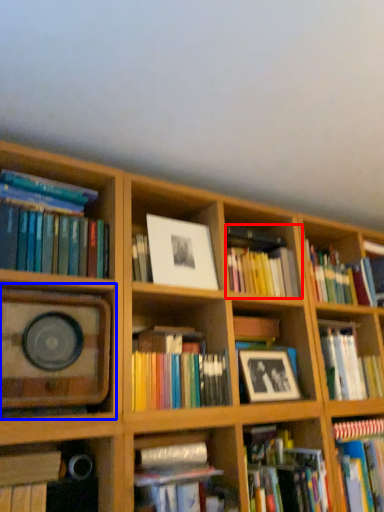
Question: Which point is closer to the camera, book (highlighted by a red box) or shelf (highlighted by a blue box)?

Choices:
 (A) book
 (B) shelf

Answer: (B)